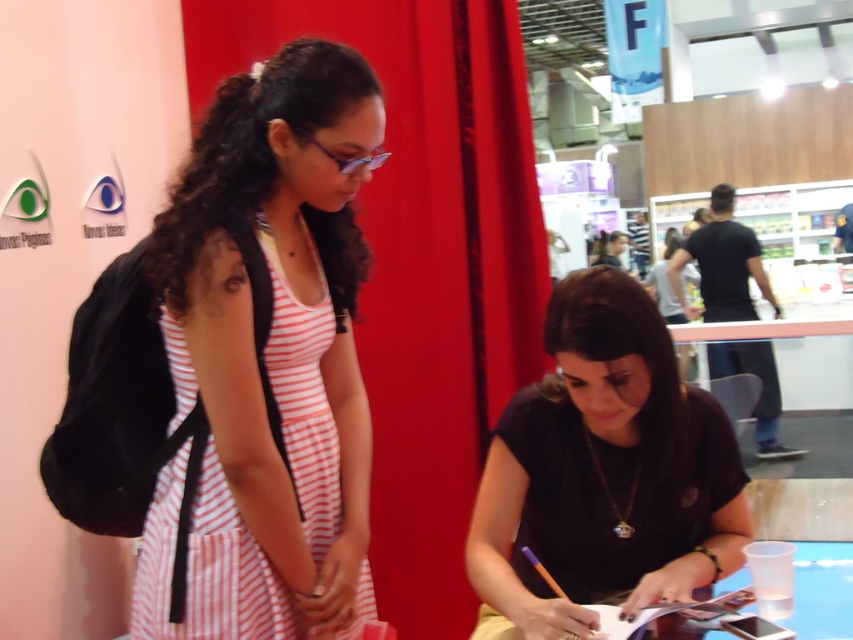
Does pink striped dress at left appear over black matte shirt at center?

Indeed, pink striped dress at left is positioned over black matte shirt at center.

Who is positioned more to the right, pink striped dress at left or black matte shirt at center?

From the viewer's perspective, black matte shirt at center appears more on the right side.

Locate an element on the screen. Image resolution: width=853 pixels, height=640 pixels. pink striped dress at left is located at coordinates (267, 358).

At what (x,y) coordinates should I click in order to perform the action: click on pink striped dress at left. Please return your answer as a coordinate pair (x, y). Looking at the image, I should click on (267, 358).